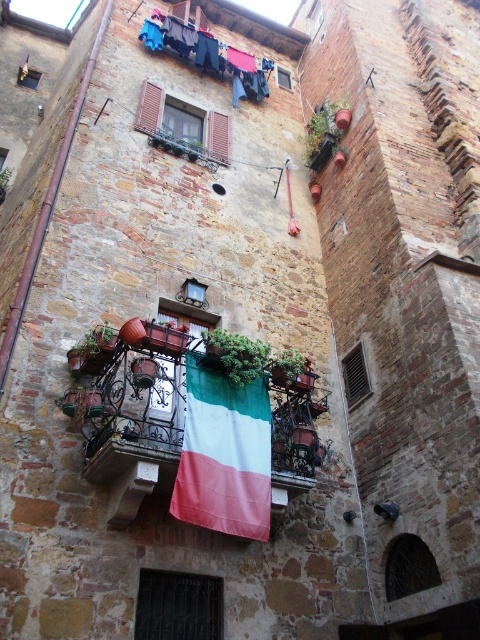
Question: Which object is farther from the camera taking this photo?

Choices:
 (A) red-white-green fabric flag at center
 (B) blue fabric clothesline at upper center

Answer: (B)

Question: Can you confirm if red-white-green fabric flag at center is positioned below blue fabric clothesline at upper center?

Choices:
 (A) no
 (B) yes

Answer: (B)

Question: From the image, what is the correct spatial relationship of red-white-green fabric flag at center in relation to blue fabric clothesline at upper center?

Choices:
 (A) above
 (B) below

Answer: (B)

Question: Which of the following is the closest to the observer?

Choices:
 (A) click(x=190, y=385)
 (B) click(x=271, y=65)

Answer: (A)

Question: Does red-white-green fabric flag at center appear on the right side of blue fabric clothesline at upper center?

Choices:
 (A) no
 (B) yes

Answer: (B)